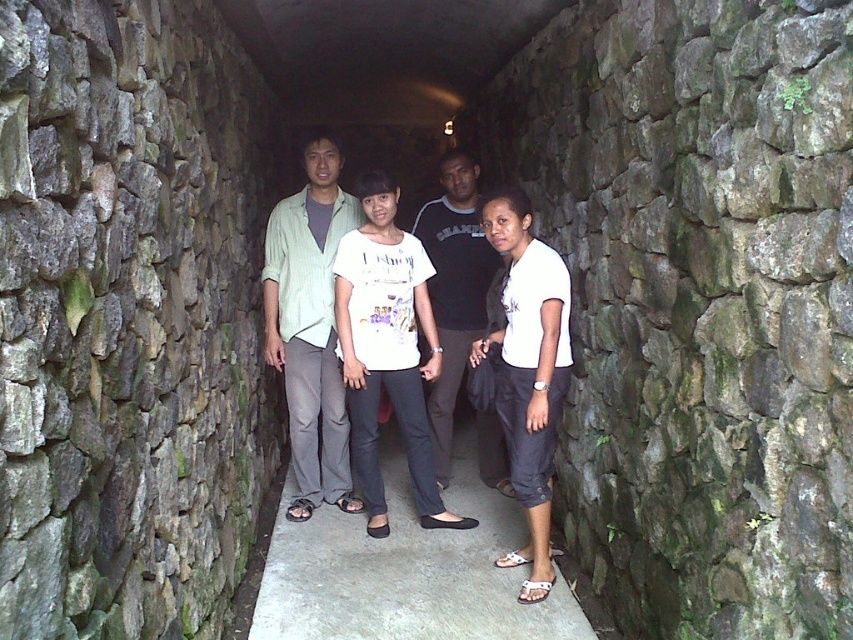
You are one of the four people in the corridor. You are wearing the light green fabric shirt at center and want to hand a note to the person wearing the black cotton shirt at center. Since the corridor is narrow, you need to know if you can reach them without moving. Are you directly above them?

The light green fabric shirt at center is above the black cotton shirt at center, so yes, you can reach them without moving because you are positioned directly above them in the corridor.

You are one of the four people in the corridor. You notice the light green fabric shirt at center and the white cotton shirt at center. Which shirt is taller?

The light green fabric shirt at center is taller than the white cotton shirt at center.